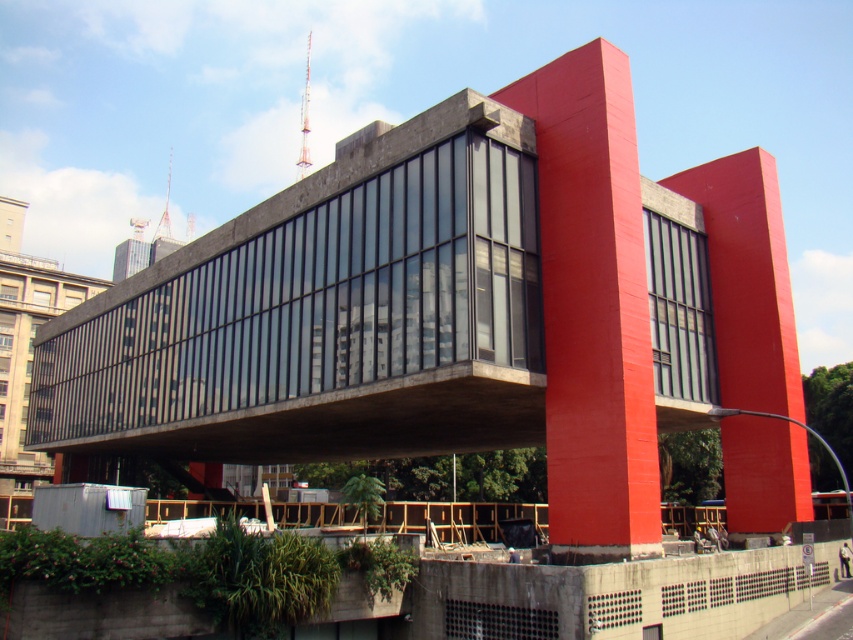
You are an architect analyzing the structural integrity of the modern building. You notice the smooth concrete pillar at center. Based on its 2D location coordinates, where exactly is this pillar positioned in the image?

The smooth concrete pillar at center is positioned at the coordinates point (593, 307) in the image.

You are standing in front of the modern building and want to take a photo of both the smooth concrete pillar at center and the matte concrete pillar at right. Which pillar should you focus on first to ensure both are in the frame?

You should focus on the smooth concrete pillar at center first since it is closer to you than the matte concrete pillar at right, ensuring both are in the frame.

You are an architect reviewing the design of the modern building. You notice two pillars supporting the cantilevered section. Which pillar, the smooth concrete pillar at center or the matte concrete pillar at right, is positioned closer to the left side of the building?

The smooth concrete pillar at center is positioned closer to the left side of the building than the matte concrete pillar at right.